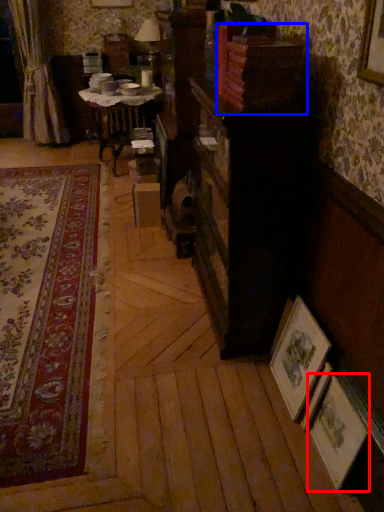
Question: Among these objects, which one is nearest to the camera, picture frame (highlighted by a red box) or shelf (highlighted by a blue box)?

Choices:
 (A) picture frame
 (B) shelf

Answer: (A)